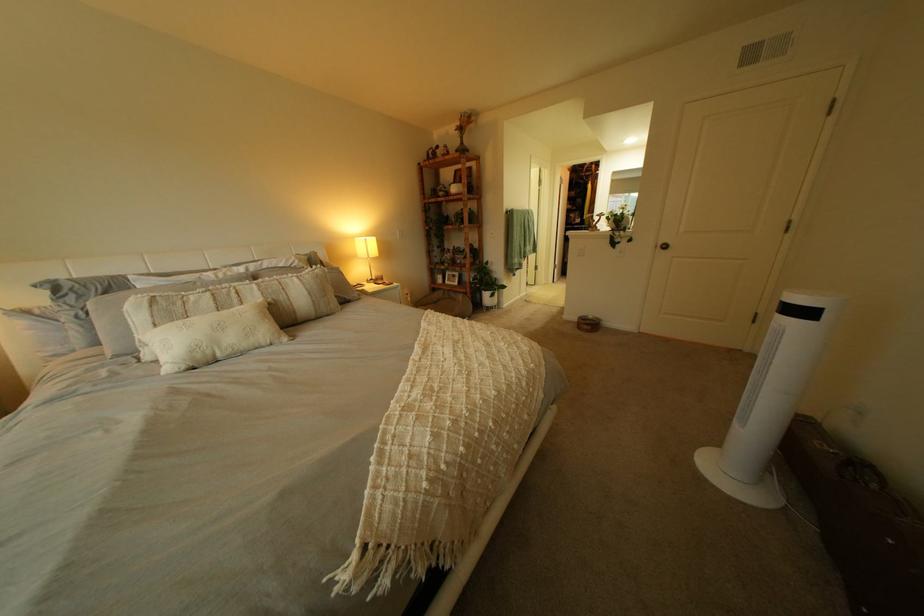
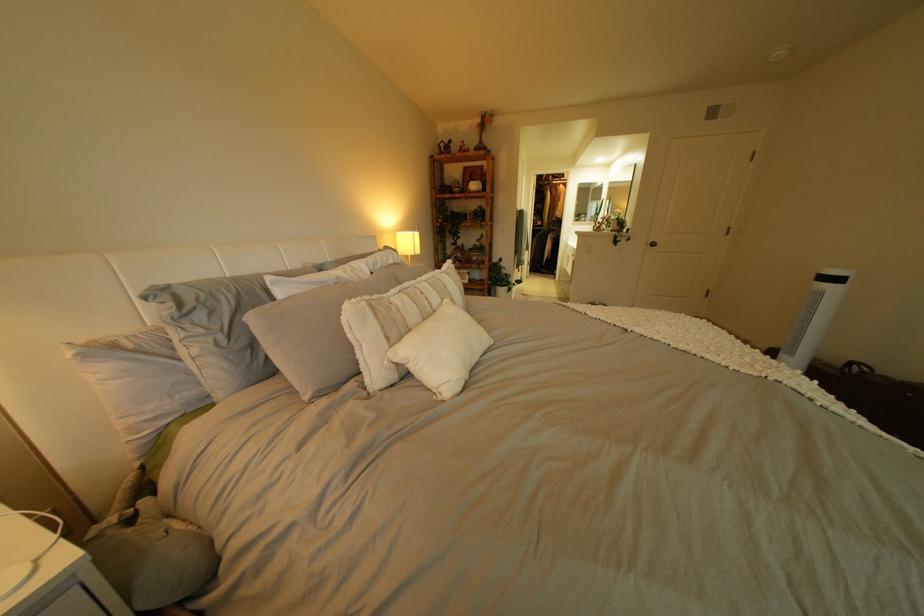
Question: In a continuous first-person perspective shot, in which direction is the camera moving?

Choices:
 (A) Left
 (B) Right
 (C) Forward
 (D) Backward

Answer: (A)